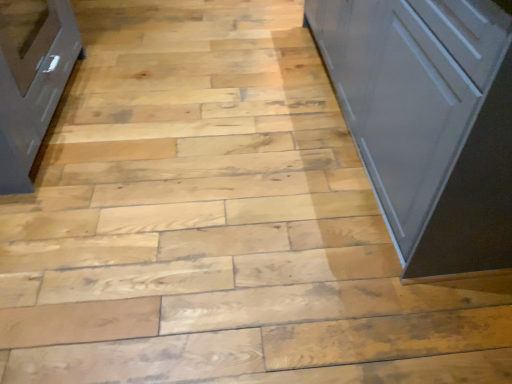
Question: Based on their sizes in the image, would you say white glossy cupboard at right is bigger or smaller than matte gray cabinet at left?

Choices:
 (A) small
 (B) big

Answer: (B)

Question: From the image's perspective, is white glossy cupboard at right above or below matte gray cabinet at left?

Choices:
 (A) above
 (B) below

Answer: (A)

Question: Is white glossy cupboard at right inside the boundaries of matte gray cabinet at left, or outside?

Choices:
 (A) inside
 (B) outside

Answer: (B)

Question: Is matte gray cabinet at left wider or thinner than white glossy cupboard at right?

Choices:
 (A) wide
 (B) thin

Answer: (B)

Question: Considering the positions of matte gray cabinet at left and white glossy cupboard at right in the image, is matte gray cabinet at left bigger or smaller than white glossy cupboard at right?

Choices:
 (A) small
 (B) big

Answer: (A)

Question: Considering the positions of matte gray cabinet at left and white glossy cupboard at right in the image, is matte gray cabinet at left taller or shorter than white glossy cupboard at right?

Choices:
 (A) tall
 (B) short

Answer: (B)

Question: From the image's perspective, is matte gray cabinet at left located above or below white glossy cupboard at right?

Choices:
 (A) below
 (B) above

Answer: (A)